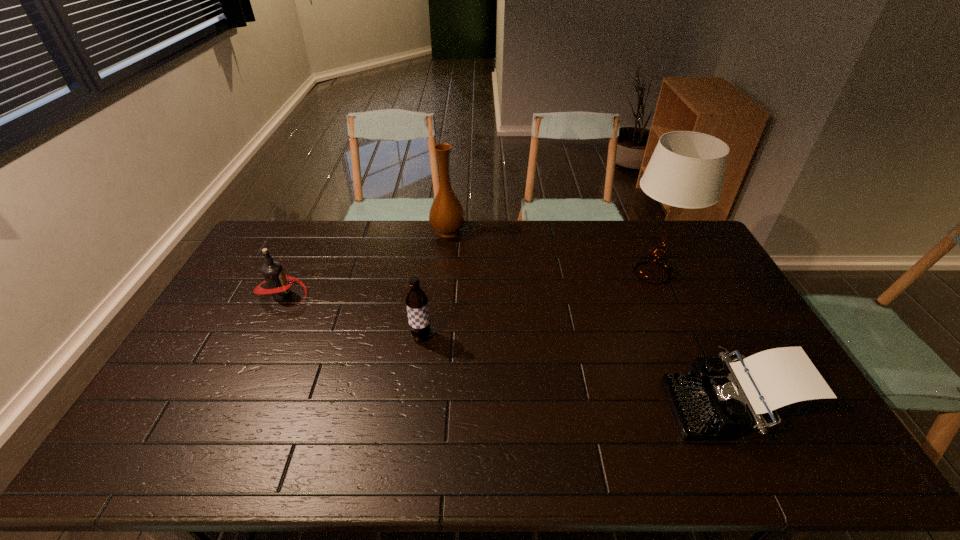
The image size is (960, 540). I want to click on table lamp, so click(686, 170).

You are a GUI agent. You are given a task and a screenshot of the screen. Output one action in this format:
    pyautogui.click(x=<x>, y=<y>)
    Task: Click on the farthest object
    The image size is (960, 540).
    Given the screenshot: What is the action you would take?
    pyautogui.click(x=447, y=217)

Find the location of a particular element. vase is located at coordinates (447, 217).

Locate an element on the screen. Image resolution: width=960 pixels, height=540 pixels. the third shortest object is located at coordinates (416, 300).

The height and width of the screenshot is (540, 960). Find the location of `the taller root beer`. the taller root beer is located at coordinates (416, 300).

Image resolution: width=960 pixels, height=540 pixels. I want to click on the fourth tallest object, so click(x=277, y=281).

Identify the location of the farther root beer. (277, 281).

The width and height of the screenshot is (960, 540). Identify the location of the nearest object. (719, 397).

Identify the location of the shortest object. (719, 397).

Where is `blank area located 0.190m on the front-facing side of the table lamp`? Image resolution: width=960 pixels, height=540 pixels. blank area located 0.190m on the front-facing side of the table lamp is located at coordinates (564, 273).